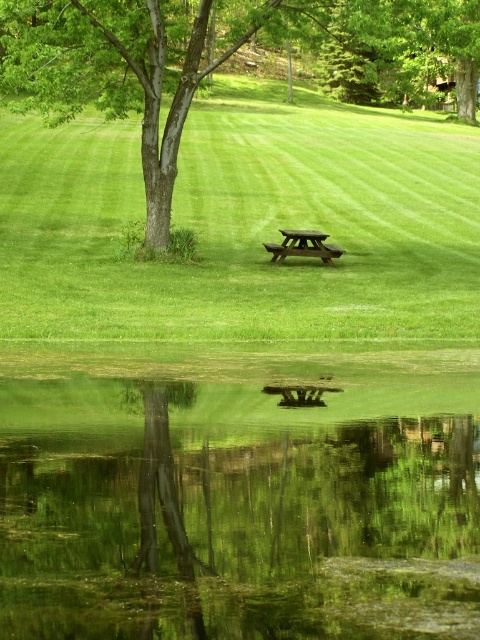
You are planning to set up a picnic and need to choose between the green leafy tree at center and the brown wooden picnic table at center for shade. Which object provides more shade coverage?

The green leafy tree at center is taller than the brown wooden picnic table at center, so it likely provides more shade coverage.

You are planning to place a new decorative statue exactly between the green leafy tree at center and the brown wooden bench at center. Considering their sizes, which object will the statue be closer to?

The statue will be closer to the brown wooden bench at center because the green leafy tree at center is bigger, meaning the bench is smaller and thus the statue placed between them would be nearer to the smaller object.

You are planning to have a picnic and need to decide between placing your blanket under the green leafy tree at center or at the brown wooden picnic table at center. Which location offers more shade due to the tree canopy?

The green leafy tree at center offers more shade because it is larger in size compared to the brown wooden picnic table at center.